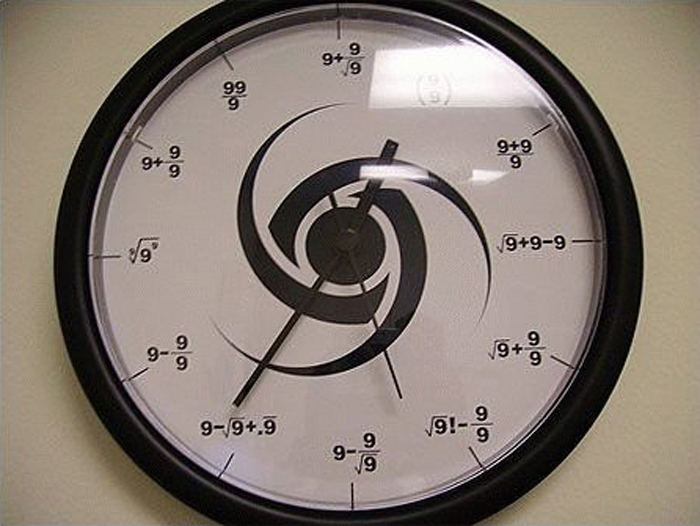
Locate an element on the screen. The height and width of the screenshot is (526, 700). arms of clock are black is located at coordinates (336, 250), (357, 210), (447, 75).